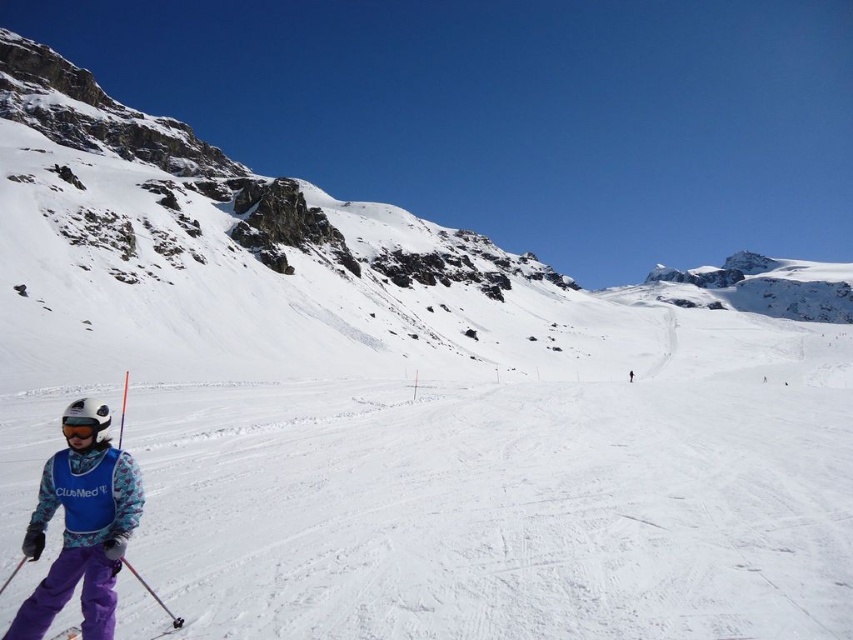
Question: Which point is farther from the camera taking this photo?

Choices:
 (A) (383, 285)
 (B) (108, 582)
 (C) (49, 637)

Answer: (A)

Question: Is white snow-covered mountain at center smaller than purple fabric ski suit at lower left?

Choices:
 (A) yes
 (B) no

Answer: (B)

Question: Does white snow-covered mountain at center have a greater width compared to purple fabric ski at lower left?

Choices:
 (A) yes
 (B) no

Answer: (A)

Question: Which is nearer to the purple fabric ski suit at lower left?

Choices:
 (A) purple fabric ski at lower left
 (B) white snow-covered mountain at center
 (C) white matte goggles at lower left

Answer: (A)

Question: Which of the following is the farthest from the observer?

Choices:
 (A) purple fabric ski suit at lower left
 (B) white matte goggles at lower left

Answer: (B)

Question: Is purple fabric ski suit at lower left thinner than white matte goggles at lower left?

Choices:
 (A) no
 (B) yes

Answer: (A)